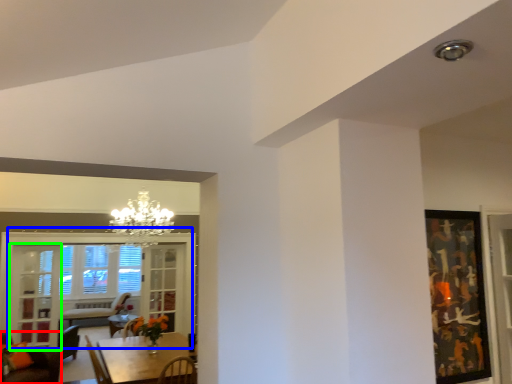
Question: Which object is the farthest from chair (highlighted by a red box)? Choose among these: window (highlighted by a blue box) or glass door (highlighted by a green box).

Choices:
 (A) window
 (B) glass door

Answer: (A)